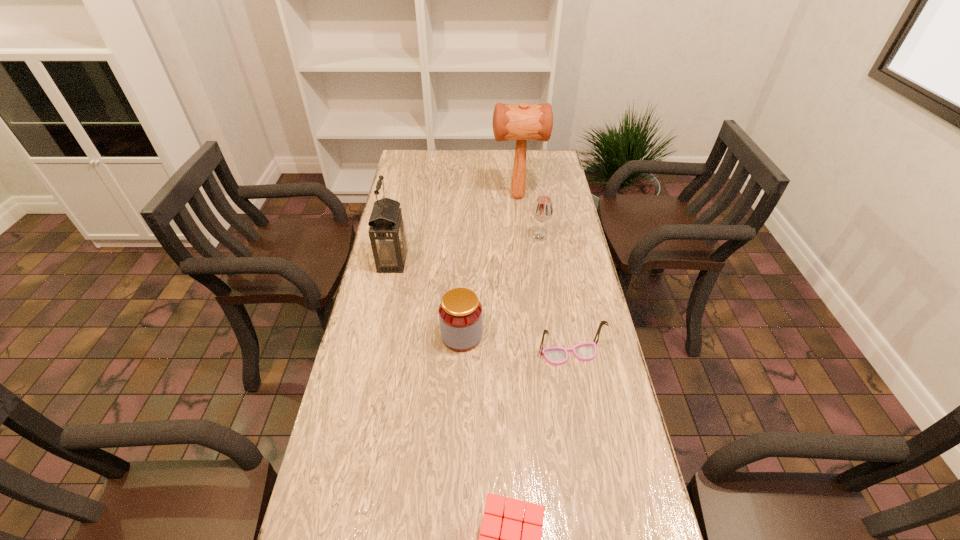
Locate an element on the screen. free space at the right edge of the desktop is located at coordinates (558, 189).

The image size is (960, 540). Find the location of `vacant area at the far left corner`. vacant area at the far left corner is located at coordinates (432, 158).

Identify the location of free space between the tallest object and the fifth shortest object. This screenshot has width=960, height=540. (455, 228).

Where is `vacant area between the tallest object and the wineglass`? This screenshot has height=540, width=960. vacant area between the tallest object and the wineglass is located at coordinates (529, 217).

Identify the location of empty space between the fourth nearest object and the jar. (427, 299).

Identify the location of vacant space that's between the jar and the tallest object. The width and height of the screenshot is (960, 540). (490, 266).

At what (x,y) coordinates should I click in order to perform the action: click on free space that is in between the mallet and the wineglass. Please return your answer as a coordinate pair (x, y). Looking at the image, I should click on (529, 217).

The width and height of the screenshot is (960, 540). Identify the location of free spot between the tallest object and the third farthest object. (455, 228).

Locate an element on the screen. This screenshot has height=540, width=960. free space between the jar and the mallet is located at coordinates click(x=490, y=266).

You are a GUI agent. You are given a task and a screenshot of the screen. Output one action in this format:
    pyautogui.click(x=<x>, y=<y>)
    Task: Click on the third closest object to the spectacles
    The image size is (960, 540).
    Given the screenshot: What is the action you would take?
    pyautogui.click(x=542, y=211)